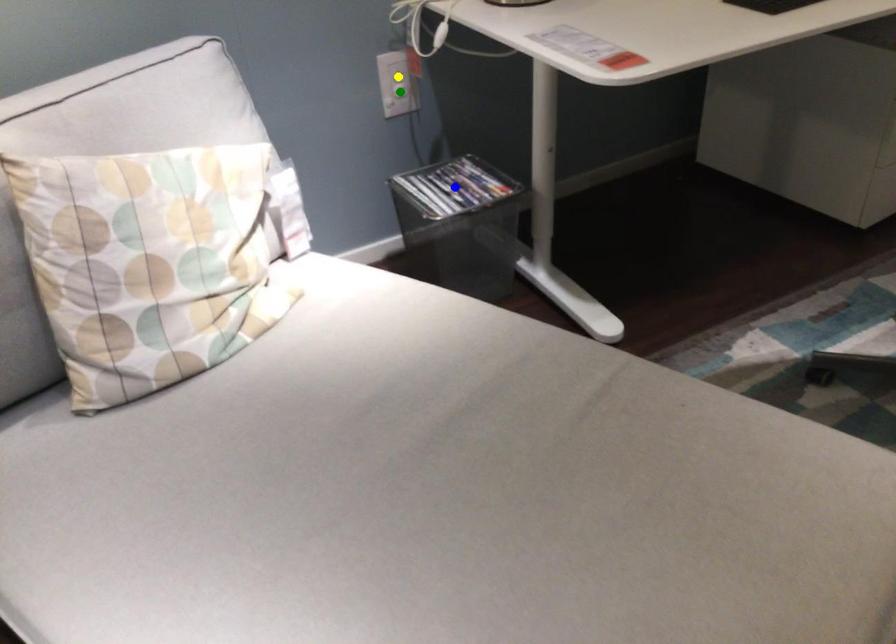
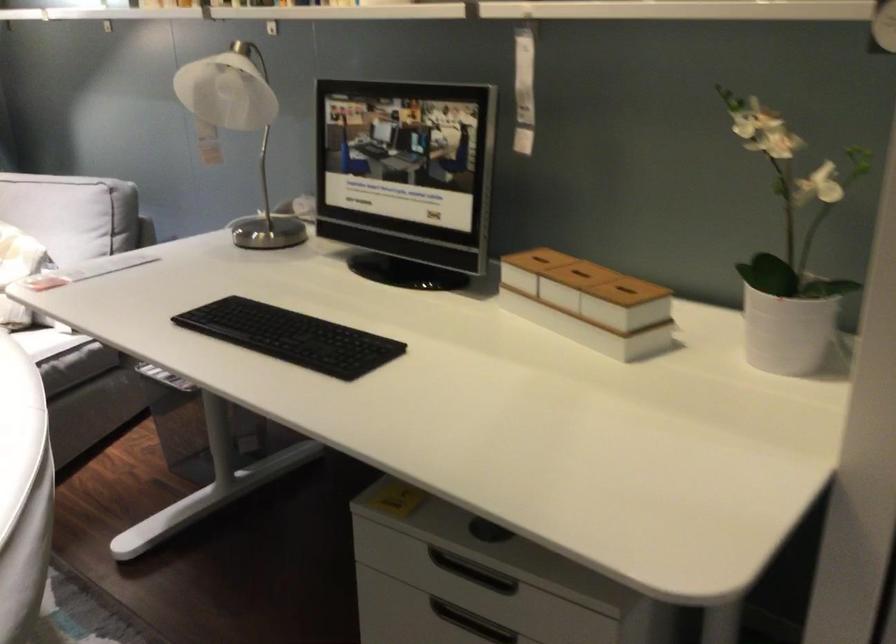
I am providing you with two images of the same scene from different viewpoints. Three points are marked in image1. Which point corresponds to a part or object that is occluded in image2?In image1, three points are marked. Which of them correspond to a part or object that is occluded in image2?Among the three points shown in image1, which one corresponds to a part or object that is no longer visible due to occlusion in image2?

Invisible in image2: yellow point, blue point, green point.